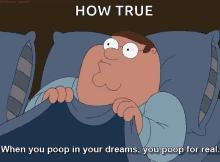
Locate an element on the screen. This screenshot has height=162, width=220. pillows is located at coordinates (190, 77), (7, 53).